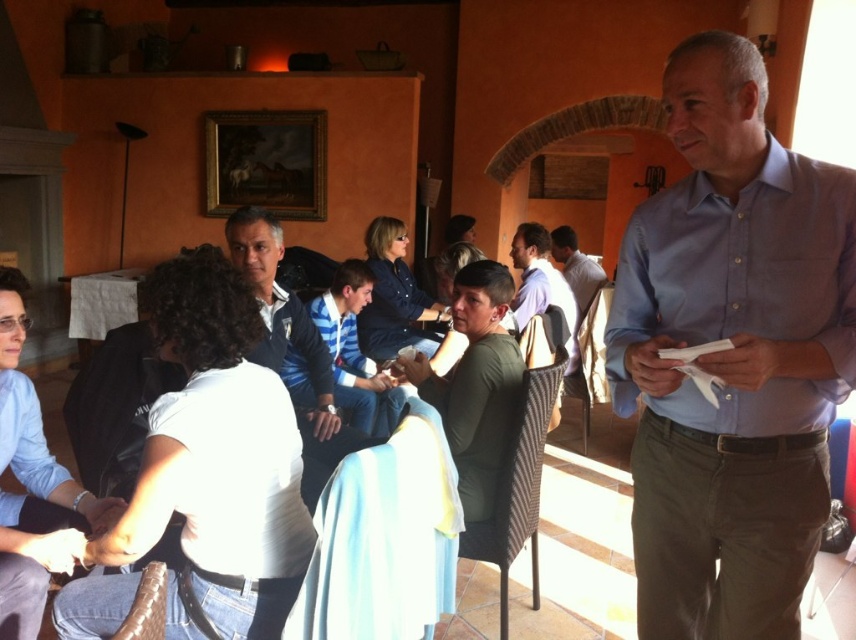
Between dark green shirt at center and matte blue shirt at center, which one has less height?

matte blue shirt at center

The image size is (856, 640). What do you see at coordinates (479, 385) in the screenshot? I see `dark green shirt at center` at bounding box center [479, 385].

Identify the location of dark green shirt at center. This screenshot has height=640, width=856. (479, 385).

Between woven brown chair at center and leather at lower left, which one has less height?

leather at lower left

The width and height of the screenshot is (856, 640). In order to click on woven brown chair at center in this screenshot , I will do `click(519, 480)`.

Is the position of brown fabric chair at lower right less distant than that of matte blue shirt at center?

Yes, brown fabric chair at lower right is in front of matte blue shirt at center.

Who is positioned more to the right, brown fabric chair at lower right or matte blue shirt at center?

Positioned to the right is brown fabric chair at lower right.

Measure the distance between point (x=841, y=496) and camera.

They are 3.48 meters apart.

Locate an element on the screen. Image resolution: width=856 pixels, height=640 pixels. brown fabric chair at lower right is located at coordinates (840, 488).